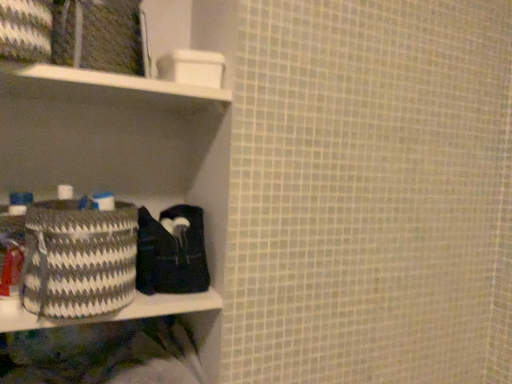
Find the location of a particular element. This screenshot has width=512, height=384. white and gray woven basket at left is located at coordinates (79, 258).

What do you see at coordinates (114, 80) in the screenshot? I see `white plastic shelf at upper left` at bounding box center [114, 80].

Locate an element on the screen. The height and width of the screenshot is (384, 512). white plastic shelf at upper left is located at coordinates (114, 80).

Describe the element at coordinates (170, 252) in the screenshot. The width and height of the screenshot is (512, 384). I see `black fabric at lower left` at that location.

What do you see at coordinates (113, 313) in the screenshot? I see `textured woven basket at lower left` at bounding box center [113, 313].

You are a GUI agent. You are given a task and a screenshot of the screen. Output one action in this format:
    pyautogui.click(x=<x>, y=<y>)
    Task: Click on the white and gray woven basket at left
    The height and width of the screenshot is (384, 512).
    Given the screenshot: What is the action you would take?
    pyautogui.click(x=79, y=258)

Does white and gray woven basket at left appear on the left side of textured woven basket at lower left?

Yes.

Considering the sizes of white and gray woven basket at left and textured woven basket at lower left in the image, is white and gray woven basket at left wider or thinner than textured woven basket at lower left?

Considering their sizes, white and gray woven basket at left looks slimmer than textured woven basket at lower left.

Is white and gray woven basket at left facing towards textured woven basket at lower left?

No, white and gray woven basket at left is not oriented towards textured woven basket at lower left.

Where is `ledge that is on the right side of white and gray woven basket at left`? This screenshot has height=384, width=512. ledge that is on the right side of white and gray woven basket at left is located at coordinates (113, 313).

From a real-world perspective, is textured woven basket at lower left above or below white plastic shelf at upper left?

textured woven basket at lower left is below white plastic shelf at upper left.

Is textured woven basket at lower left looking in the opposite direction of white plastic shelf at upper left?

That's not correct — textured woven basket at lower left is not looking away from white plastic shelf at upper left.

Which is closer, (195, 295) or (183, 90)?

Point (195, 295).

Can you tell me how much textured woven basket at lower left and white plastic shelf at upper left differ in facing direction?

There is a 0.192-degree angle between the facing directions of textured woven basket at lower left and white plastic shelf at upper left.

Does textured woven basket at lower left have a smaller size compared to white and gray woven basket at left?

Yes.

From a real-world perspective, is textured woven basket at lower left physically above white and gray woven basket at left?

A: No, from a real-world perspective, textured woven basket at lower left is not above white and gray woven basket at left.

Is textured woven basket at lower left facing away from white and gray woven basket at left?

textured woven basket at lower left does not have its back to white and gray woven basket at left.

Which object is more forward, white plastic shelf at upper left or textured woven basket at lower left?

white plastic shelf at upper left is more forward.

Is white plastic shelf at upper left spatially inside textured woven basket at lower left, or outside of it?

white plastic shelf at upper left is not enclosed by textured woven basket at lower left.

Considering the sizes of objects white plastic shelf at upper left and textured woven basket at lower left in the image provided, who is smaller, white plastic shelf at upper left or textured woven basket at lower left?

→ Smaller between the two is white plastic shelf at upper left.

Where is `ledge on the left of white plastic shelf at upper left`? This screenshot has width=512, height=384. ledge on the left of white plastic shelf at upper left is located at coordinates (113, 313).

Is white and gray woven basket at left spatially inside black fabric at lower left, or outside of it?

white and gray woven basket at left is not enclosed by black fabric at lower left.

Considering the positions of objects white and gray woven basket at left and black fabric at lower left in the image provided, who is behind, white and gray woven basket at left or black fabric at lower left?

black fabric at lower left is behind.

From a real-world perspective, is white and gray woven basket at left above or below black fabric at lower left?

From a real-world perspective, white and gray woven basket at left is physically above black fabric at lower left.

Is point (89, 258) less distant than point (203, 252)?

That is True.

Which is more to the left, black fabric at lower left or textured woven basket at lower left?

Positioned to the left is textured woven basket at lower left.

Image resolution: width=512 pixels, height=384 pixels. Find the location of `ledge below the black fabric at lower left (from the image's perspective)`. ledge below the black fabric at lower left (from the image's perspective) is located at coordinates 113,313.

From a real-world perspective, is black fabric at lower left below textured woven basket at lower left?

No.

Who is more distant, black fabric at lower left or textured woven basket at lower left?

black fabric at lower left is further from the camera.

Is white plastic shelf at upper left taller or shorter than white and gray woven basket at left?

Clearly, white plastic shelf at upper left is shorter compared to white and gray woven basket at left.

In the scene shown: Could you tell me if white plastic shelf at upper left is facing white and gray woven basket at left?

No, white plastic shelf at upper left is not facing towards white and gray woven basket at left.

Consider the image. Does white plastic shelf at upper left lie behind white and gray woven basket at left?

Yes, white plastic shelf at upper left is further from the camera.

Between white plastic shelf at upper left and white and gray woven basket at left, which one has larger width?

Wider between the two is white plastic shelf at upper left.

At what (x,y) coordinates should I click in order to perform the action: click on ledge that is below the white and gray woven basket at left (from the image's perspective). Please return your answer as a coordinate pair (x, y). The image size is (512, 384). Looking at the image, I should click on (113, 313).

The height and width of the screenshot is (384, 512). Identify the location of ledge lying on the left of white plastic shelf at upper left. (113, 313).

Which object lies further to the anchor point white plastic shelf at upper left, textured woven basket at lower left or black fabric at lower left?

textured woven basket at lower left is positioned further to the anchor white plastic shelf at upper left.

From the image, which object appears to be nearer to black fabric at lower left, white and gray woven basket at left or textured woven basket at lower left?

textured woven basket at lower left lies closer to black fabric at lower left than the other object.

Looking at the image, which one is located further to black fabric at lower left, white plastic shelf at upper left or white and gray woven basket at left?

white plastic shelf at upper left.

When comparing their distances from black fabric at lower left, does textured woven basket at lower left or white and gray woven basket at left seem closer?

textured woven basket at lower left is closer to black fabric at lower left.

Looking at the image, which one is located further to textured woven basket at lower left, white and gray woven basket at left or black fabric at lower left?

black fabric at lower left.

Looking at the image, which one is located closer to white and gray woven basket at left, white plastic shelf at upper left or textured woven basket at lower left?

Based on the image, textured woven basket at lower left appears to be nearer to white and gray woven basket at left.

From the image, which object appears to be farther from white and gray woven basket at left, black fabric at lower left or textured woven basket at lower left?

black fabric at lower left lies further to white and gray woven basket at left than the other object.

Which object lies nearer to the anchor point white plastic shelf at upper left, black fabric at lower left or textured woven basket at lower left?

black fabric at lower left.

The image size is (512, 384). In order to click on basket between white plastic shelf at upper left and textured woven basket at lower left in the vertical direction in this screenshot , I will do pyautogui.click(x=79, y=258).

Locate an element on the screen. The image size is (512, 384). material that lies between white plastic shelf at upper left and textured woven basket at lower left from top to bottom is located at coordinates (170, 252).

Image resolution: width=512 pixels, height=384 pixels. I want to click on basket that lies between white plastic shelf at upper left and black fabric at lower left from top to bottom, so click(x=79, y=258).

What are the coordinates of `ledge between white and gray woven basket at left and black fabric at lower left from front to back` in the screenshot? It's located at (113, 313).